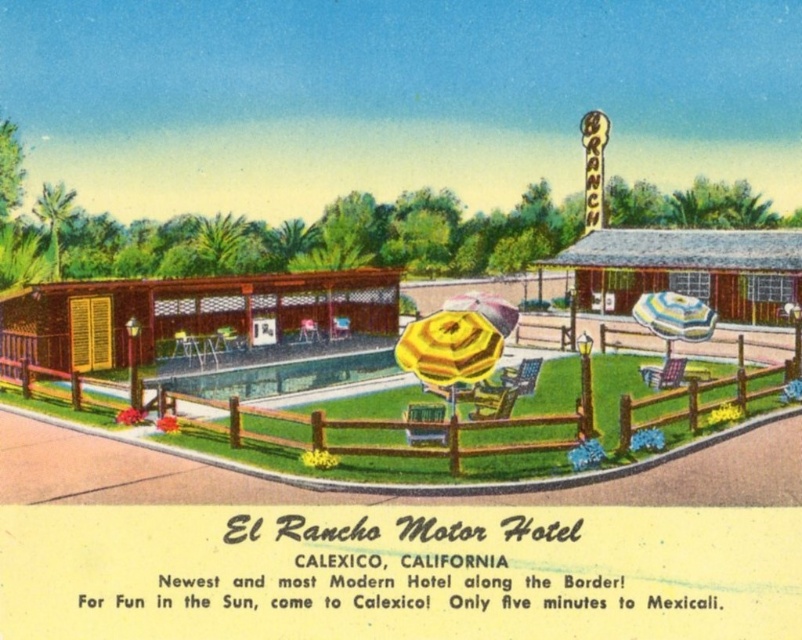
Between brown wooden fence at lower left and yellow fabric umbrella at center, which one has less height?

yellow fabric umbrella at center is shorter.

Who is positioned more to the right, brown wooden fence at lower left or yellow fabric umbrella at center?

Positioned to the right is brown wooden fence at lower left.

I want to click on brown wooden fence at lower left, so click(699, 400).

Is brown wooden fence at lower left positioned at the back of yellow striped umbrella at center?

No, brown wooden fence at lower left is in front of yellow striped umbrella at center.

Between point (408, 467) and point (440, 355), which one is positioned behind?

The point (440, 355) is behind.

Find the location of `brown wooden fence at lower left`. brown wooden fence at lower left is located at coordinates (699, 400).

Can you confirm if yellow striped umbrella at center is positioned to the right of striped fabric umbrella at center?

No, yellow striped umbrella at center is not to the right of striped fabric umbrella at center.

Locate an element on the screen. yellow striped umbrella at center is located at coordinates (450, 352).

The height and width of the screenshot is (640, 802). What do you see at coordinates (450, 352) in the screenshot? I see `yellow striped umbrella at center` at bounding box center [450, 352].

The width and height of the screenshot is (802, 640). I want to click on yellow striped umbrella at center, so click(450, 352).